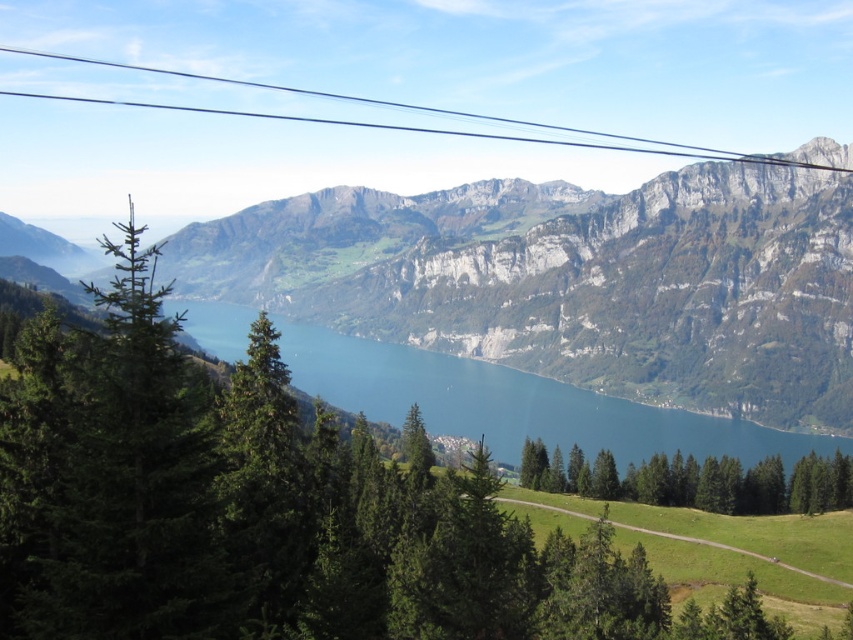
Is point (425, 305) more distant than point (827, 483)?

Yes, it is.

Locate an element on the screen. The image size is (853, 640). green grassy mountain at center is located at coordinates (573, 282).

Locate an element on the screen. This screenshot has height=640, width=853. green grassy mountain at center is located at coordinates (573, 282).

Does green grassy mountain at center have a greater height compared to black wire at upper center?

A: Incorrect, green grassy mountain at center's height is not larger of black wire at upper center's.

Is green grassy mountain at center positioned in front of black wire at upper center?

Yes, green grassy mountain at center is closer to the viewer.

Measure the distance between point (722,278) and camera.

They are 267.59 meters apart.

Image resolution: width=853 pixels, height=640 pixels. I want to click on green grassy mountain at center, so click(573, 282).

Can you confirm if green matte tree at center is positioned above black wire at upper center?

No, green matte tree at center is not above black wire at upper center.

Which is below, green matte tree at center or black wire at upper center?

green matte tree at center is below.

Between point (831, 496) and point (357, 97), which one is positioned in front?

Point (831, 496) is more forward.

I want to click on green matte tree at center, so click(695, 481).